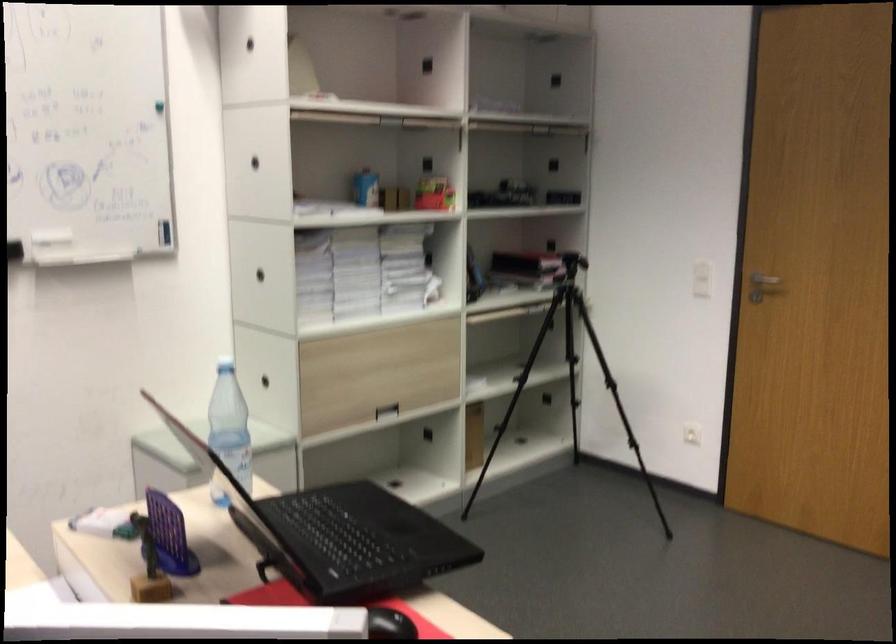
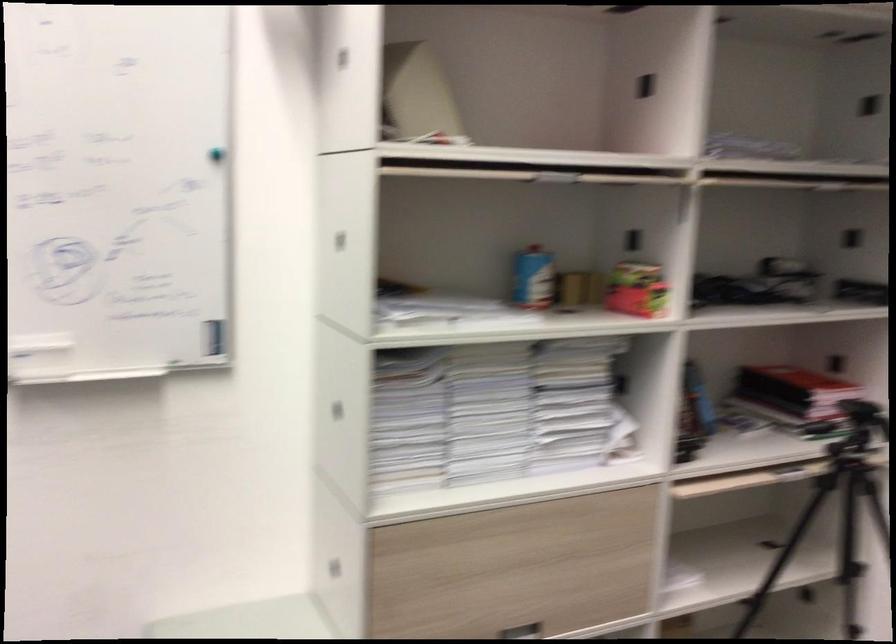
The point at (476, 384) is marked in the first image. Where is the corresponding point in the second image?

(678, 581)